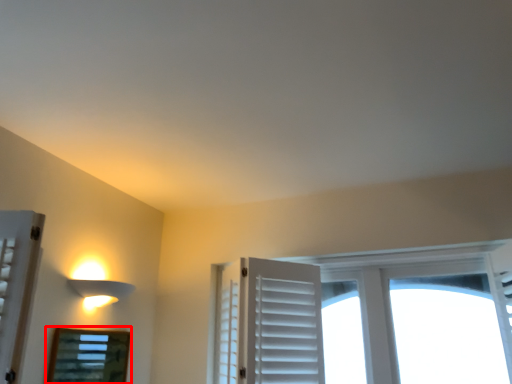
Question: From the image's perspective, considering the relative positions of bay window (annotated by the red box) and lamp in the image provided, where is bay window (annotated by the red box) located with respect to the staircase?

Choices:
 (A) below
 (B) above

Answer: (A)